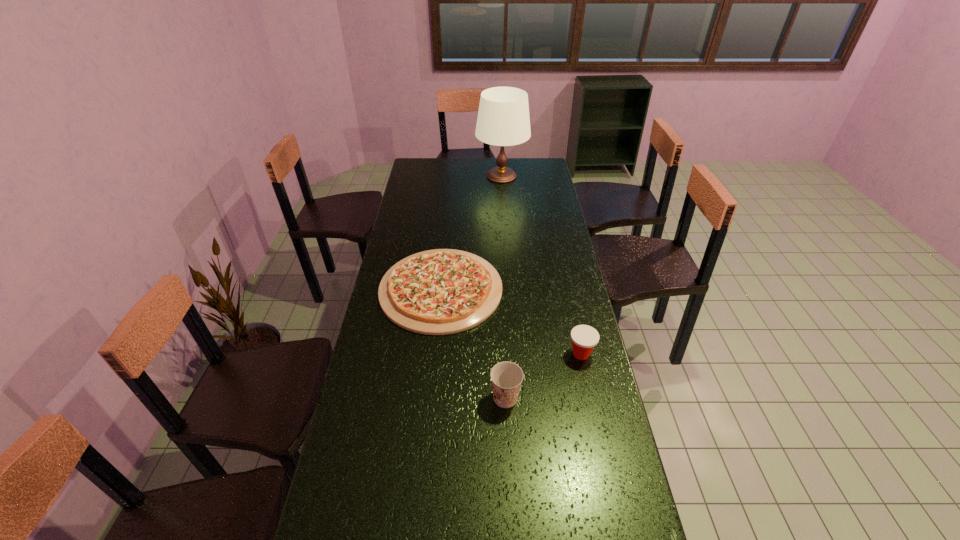
At what (x,y) coordinates should I click in order to perform the action: click on free spot located 0.050m on the back of the third farthest object. Please return your answer as a coordinate pair (x, y). The image size is (960, 540). Looking at the image, I should click on (576, 333).

Find the location of `vacant space located 0.190m on the right of the shortest object`. vacant space located 0.190m on the right of the shortest object is located at coordinates (551, 289).

The image size is (960, 540). I want to click on object present at the far edge, so click(503, 119).

The image size is (960, 540). What are the coordinates of `object at the left edge` in the screenshot? It's located at (443, 291).

Where is `lamp present at the right edge`? lamp present at the right edge is located at coordinates (503, 119).

Where is `Dixie cup at the right edge`? The width and height of the screenshot is (960, 540). Dixie cup at the right edge is located at coordinates (584, 338).

At what (x,y) coordinates should I click in order to perform the action: click on object at the far right corner. Please return your answer as a coordinate pair (x, y). This screenshot has width=960, height=540. Looking at the image, I should click on (503, 119).

Find the location of `free space at the left edge of the desktop`. free space at the left edge of the desktop is located at coordinates (320, 518).

Image resolution: width=960 pixels, height=540 pixels. What are the coordinates of `blank space at the right edge of the desktop` in the screenshot? It's located at [x=555, y=251].

In the image, there is a desktop. What are the coordinates of `vacant space at the far right corner` in the screenshot? It's located at (545, 166).